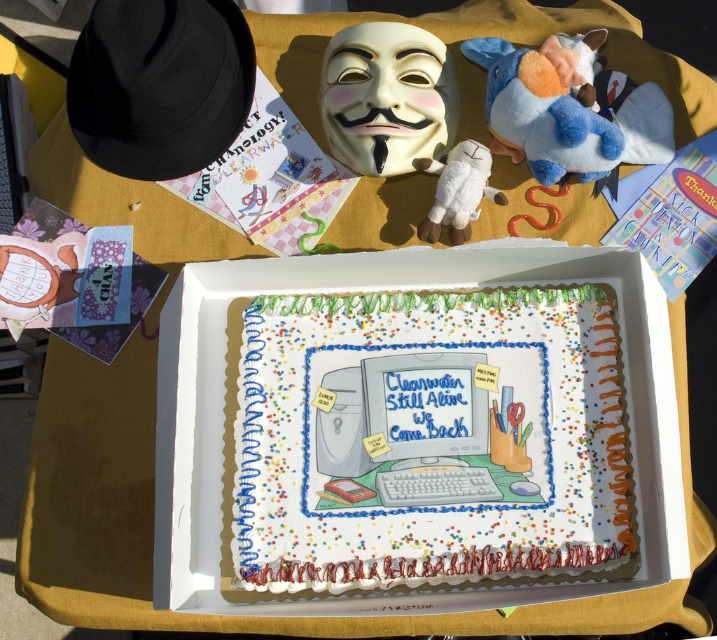
You are at a party and see the white matte mask at upper center and the white plush toy at center on the table. Which one is closer to the left edge of the table?

The white matte mask at upper center is closer to the left edge of the table because it is positioned to the left of the white plush toy at center.

You are organizing a birthday party and need to place a 12 cm tall decoration on the table. The blue plush toy at upper right and the white plush toy at center are already there. Which plush toy can accommodate the decoration without blocking it?

The blue plush toy at upper right is bigger than the white plush toy at center, so the decoration can be placed on the blue plush toy at upper right without blocking it.

You are planning to take a photo of the white frosted sheet cake at center and the blue plush toy at upper right for a social media post. Which object should you focus on first if you want to highlight the larger item in your shot?

You should focus on the white frosted sheet cake at center first because it is larger than the blue plush toy at upper right.